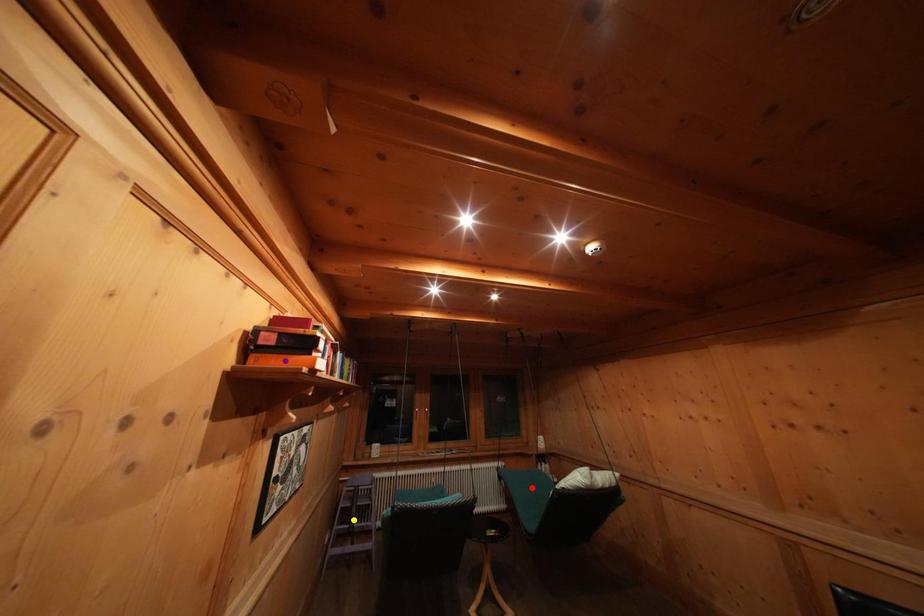
Order these from nearest to farthest:
red point
yellow point
purple point

purple point < yellow point < red point